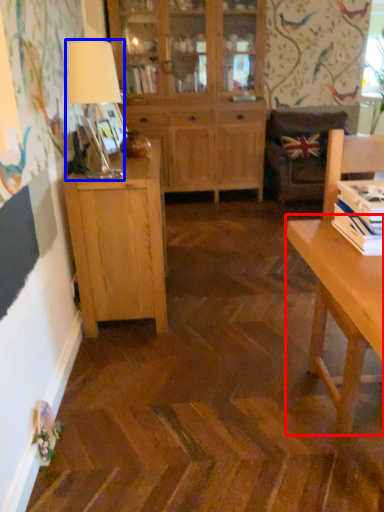
Question: Which of the following is the closest to the observer, desk (highlighted by a red box) or table lamp (highlighted by a blue box)?

Choices:
 (A) desk
 (B) table lamp

Answer: (A)